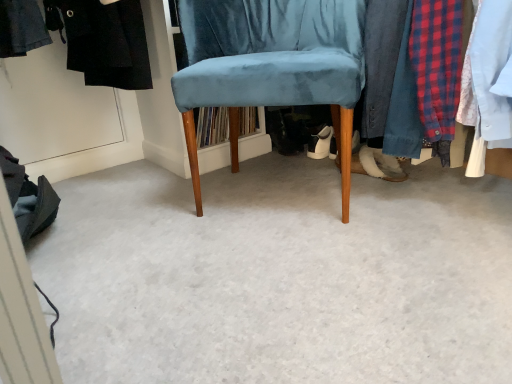
At what (x,y) coordinates should I click in order to perform the action: click on free space in front of velvet blue chair at center. Please return your answer as a coordinate pair (x, y). This screenshot has height=384, width=512. Looking at the image, I should click on (294, 277).